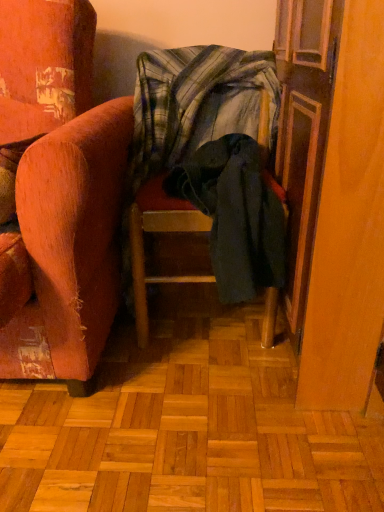
Question: From the image's perspective, is dark green fabric chair at center located above wooden screen door at right?

Choices:
 (A) yes
 (B) no

Answer: (B)

Question: Does dark green fabric chair at center come in front of wooden screen door at right?

Choices:
 (A) yes
 (B) no

Answer: (B)

Question: Is dark green fabric chair at center to the left of wooden screen door at right from the viewer's perspective?

Choices:
 (A) yes
 (B) no

Answer: (A)

Question: Is dark green fabric chair at center bigger than wooden screen door at right?

Choices:
 (A) yes
 (B) no

Answer: (B)

Question: Is dark green fabric chair at center turned away from wooden screen door at right?

Choices:
 (A) yes
 (B) no

Answer: (B)

Question: Which is correct: dark green fabric chair at center is inside plaid fabric blanket at center, or outside of it?

Choices:
 (A) inside
 (B) outside

Answer: (B)

Question: Would you say dark green fabric chair at center is to the left or to the right of plaid fabric blanket at center in the picture?

Choices:
 (A) left
 (B) right

Answer: (B)

Question: Is dark green fabric chair at center in front of or behind plaid fabric blanket at center in the image?

Choices:
 (A) front
 (B) behind

Answer: (A)

Question: From their relative heights in the image, would you say dark green fabric chair at center is taller or shorter than plaid fabric blanket at center?

Choices:
 (A) short
 (B) tall

Answer: (B)

Question: From a real-world perspective, is plaid fabric blanket at center physically located above or below wooden screen door at right?

Choices:
 (A) above
 (B) below

Answer: (A)

Question: Is plaid fabric blanket at center in front of or behind wooden screen door at right in the image?

Choices:
 (A) behind
 (B) front

Answer: (A)

Question: Is point (180, 105) closer or farther from the camera than point (365, 193)?

Choices:
 (A) closer
 (B) farther

Answer: (B)

Question: Considering the relative positions of plaid fabric blanket at center and wooden screen door at right in the image provided, is plaid fabric blanket at center to the left or to the right of wooden screen door at right?

Choices:
 (A) right
 (B) left

Answer: (B)

Question: Choose the correct answer: Is wooden screen door at right inside dark green fabric chair at center or outside it?

Choices:
 (A) outside
 (B) inside

Answer: (A)

Question: In terms of height, does wooden screen door at right look taller or shorter compared to dark green fabric chair at center?

Choices:
 (A) tall
 (B) short

Answer: (A)